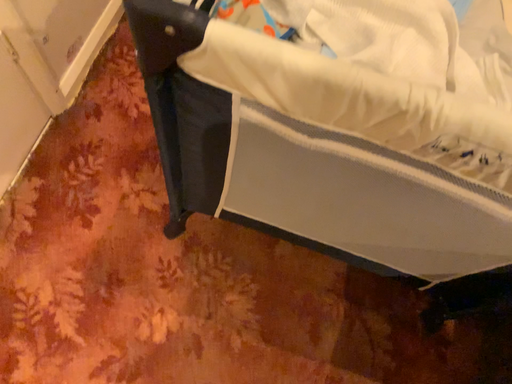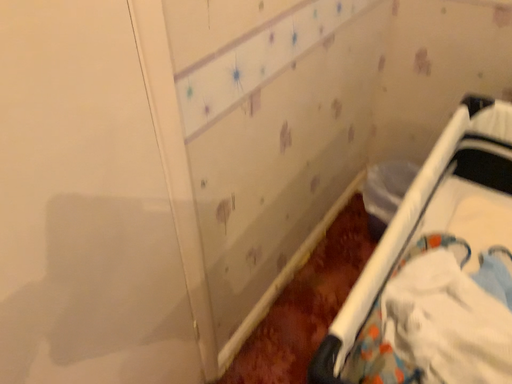
Question: How did the camera likely rotate when shooting the video?

Choices:
 (A) rotated left
 (B) rotated right

Answer: (A)